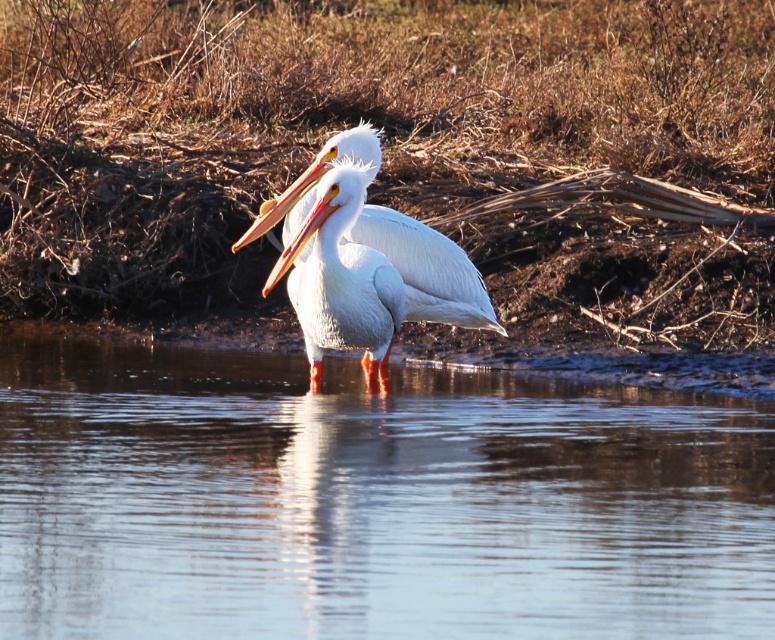
You are a wildlife photographer aiming to capture a closeup shot of the matte orange beak at center while also including the white smooth pelican at center in the frame. Given that your camera has a maximum focus range of 70 centimeters, will you be able to achieve this shot?

The white smooth pelican at center is 69.67 centimeters away from the matte orange beak at center. Since the distance is just under the camera maximum focus range of 70 centimeters, you can achieve the shot by positioning the camera to include both within the 70 cm range.

You are a wildlife photographer aiming to capture a closeup of the white smooth pelican at center and the matte orange beak at center. Since you want to focus on the pelican, which object should you zoom in on more, and why?

You should zoom in more on the white smooth pelican at center because it is bigger than the matte orange beak at center, making it the primary subject for a closeup.